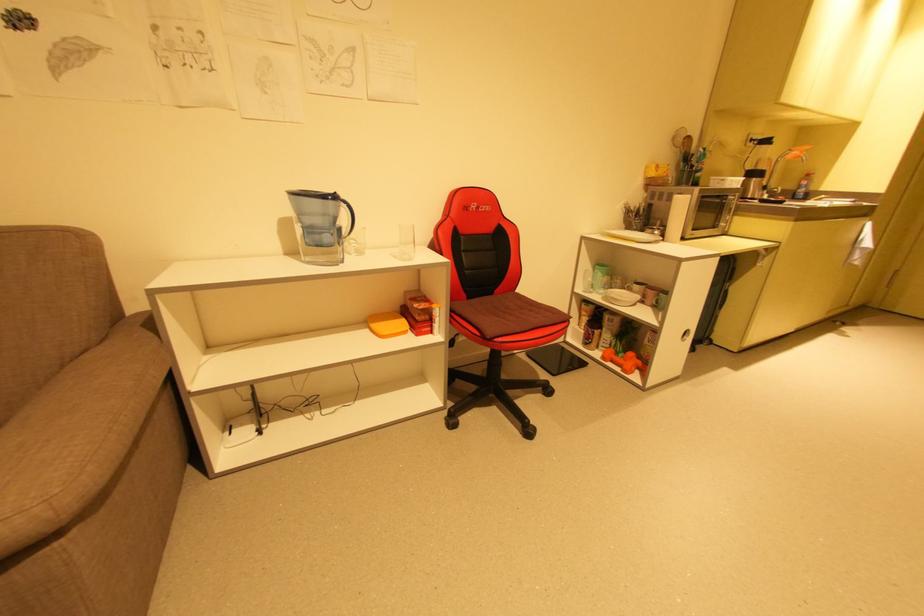
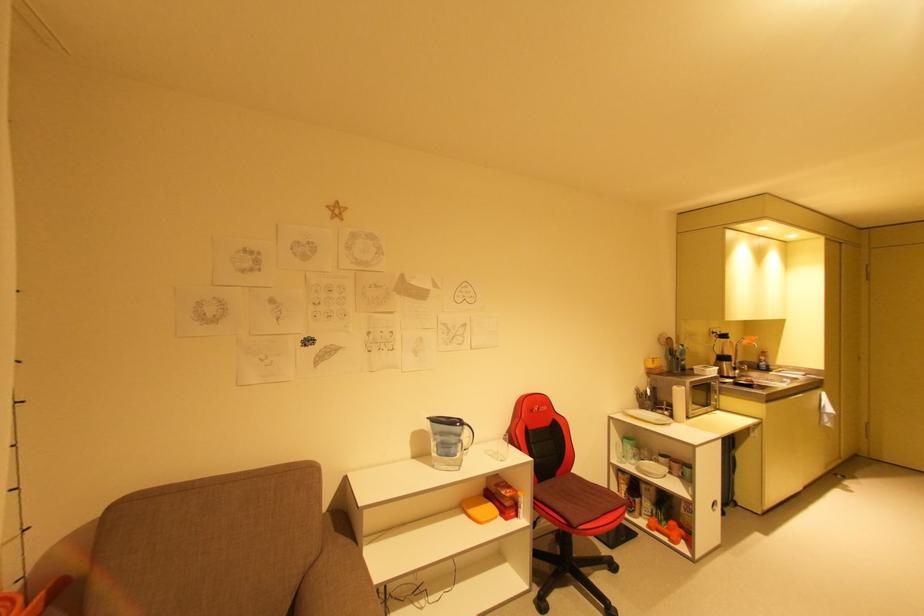
Find the pixel in the second image that matches point (629, 368) in the first image.

(675, 538)